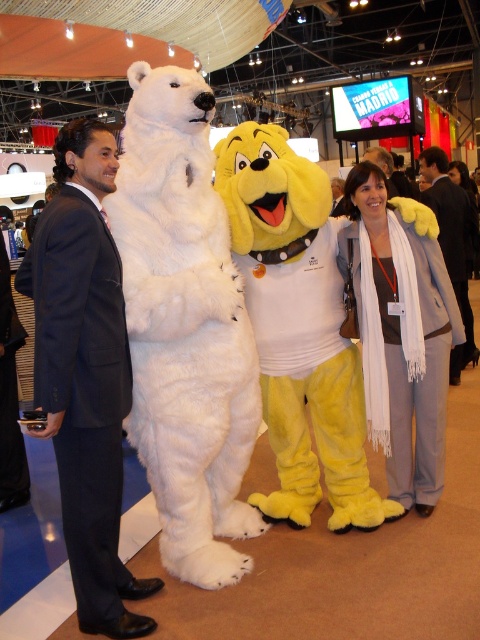
Can you confirm if dark blue suit at left is positioned above white scarf at center?

A: No, dark blue suit at left is not above white scarf at center.

Can you confirm if dark blue suit at left is wider than white scarf at center?

No.

In the scene shown: Who is more forward, (84, 234) or (384, 336)?

Point (84, 234)

You are a GUI agent. You are given a task and a screenshot of the screen. Output one action in this format:
    pyautogui.click(x=<x>, y=<y>)
    Task: Click on the dark blue suit at left
    This screenshot has width=480, height=640.
    Given the screenshot: What is the action you would take?
    pyautogui.click(x=84, y=372)

Can you confirm if white furry bear at left is wider than dark blue suit at left?

→ Correct, the width of white furry bear at left exceeds that of dark blue suit at left.

Is point (192, 84) positioned before point (120, 348)?

No, it is behind (120, 348).

Is point (158, 339) positioned behind point (87, 627)?

Yes, point (158, 339) is behind point (87, 627).

Where is `white furry bear at left`? white furry bear at left is located at coordinates (184, 326).

Between point (370, 282) and point (439, 163), which one is positioned in front?

Point (370, 282) is more forward.

Is the position of white scarf at center less distant than that of dark suit at center?

Yes, white scarf at center is in front of dark suit at center.

Is point (406, 480) positioned after point (437, 157)?

No, (406, 480) is closer to viewer.

Locate an element on the screen. This screenshot has height=640, width=480. white scarf at center is located at coordinates (400, 332).